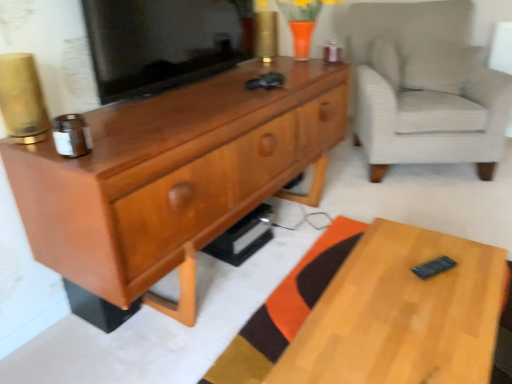
The width and height of the screenshot is (512, 384). I want to click on vacant point to the left of light wood desk at lower right, so click(216, 329).